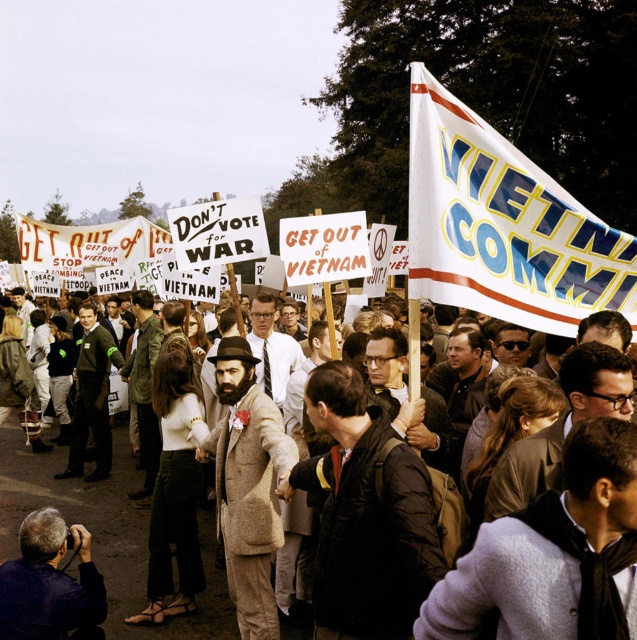
Which is above, beige wool coat at center or gray fabric camera at lower left?

beige wool coat at center is higher up.

Is beige wool coat at center closer to the viewer compared to gray fabric camera at lower left?

No, it is behind gray fabric camera at lower left.

Image resolution: width=637 pixels, height=640 pixels. Describe the element at coordinates (247, 484) in the screenshot. I see `beige wool coat at center` at that location.

At what (x,y) coordinates should I click in order to perform the action: click on beige wool coat at center. Please return your answer as a coordinate pair (x, y). The height and width of the screenshot is (640, 637). Looking at the image, I should click on (247, 484).

Is gray fabric camera at lower left to the left of white paper sign at left from the viewer's perspective?

Incorrect, gray fabric camera at lower left is not on the left side of white paper sign at left.

Image resolution: width=637 pixels, height=640 pixels. I want to click on gray fabric camera at lower left, so click(50, 582).

Can you confirm if brown wool coat at center is positioned below white paper sign at left?

Yes, brown wool coat at center is below white paper sign at left.

You are a GUI agent. You are given a task and a screenshot of the screen. Output one action in this format:
    pyautogui.click(x=<x>, y=<y>)
    Task: Click on the brown wool coat at center
    The height and width of the screenshot is (640, 637).
    Given the screenshot: What is the action you would take?
    pyautogui.click(x=108, y=532)